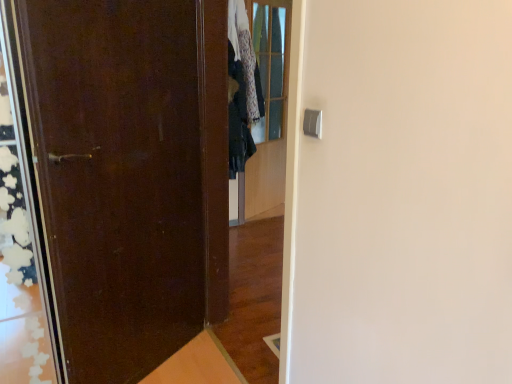
Locate an element on the screen. The width and height of the screenshot is (512, 384). dark green fabric at center is located at coordinates (242, 88).

What do you see at coordinates (242, 88) in the screenshot? I see `dark green fabric at center` at bounding box center [242, 88].

The image size is (512, 384). Identify the location of clear glass door at upper center. (268, 110).

The image size is (512, 384). What do you see at coordinates (268, 110) in the screenshot? I see `clear glass door at upper center` at bounding box center [268, 110].

You are a GUI agent. You are given a task and a screenshot of the screen. Output one action in this format:
    pyautogui.click(x=<x>, y=<y>)
    Task: Click on the matte dark brown door at left
    
    Given the screenshot: What is the action you would take?
    pyautogui.click(x=119, y=176)

Is clear glass door at upper center thinner than matte dark brown door at left?

Yes, clear glass door at upper center is thinner than matte dark brown door at left.

From a real-world perspective, between clear glass door at upper center and matte dark brown door at left, who is vertically higher?

clear glass door at upper center, from a real-world perspective.

Which is closer to the camera, (257, 211) or (242, 85)?

Point (257, 211).

Is clear glass door at upper center completely or partially outside of dark green fabric at center?

Absolutely, clear glass door at upper center is external to dark green fabric at center.

From the picture: Is clear glass door at upper center wider than dark green fabric at center?

Incorrect, the width of clear glass door at upper center does not surpass that of dark green fabric at center.

How much distance is there between dark green fabric at center and clear glass door at upper center?

dark green fabric at center and clear glass door at upper center are 13.16 inches apart from each other.

The height and width of the screenshot is (384, 512). I want to click on clothing above the clear glass door at upper center (from the image's perspective), so click(242, 88).

Is dark green fabric at center aimed at clear glass door at upper center?

No, dark green fabric at center is not aimed at clear glass door at upper center.

Looking at this image, is the surface of dark green fabric at center in direct contact with clear glass door at upper center?

No, dark green fabric at center is not touching clear glass door at upper center.

Is clear glass door at upper center located within matte dark brown door at left?

That's incorrect, clear glass door at upper center is not inside matte dark brown door at left.

Does matte dark brown door at left have a lesser height compared to clear glass door at upper center?

Yes, matte dark brown door at left is shorter than clear glass door at upper center.

Considering the relative positions of matte dark brown door at left and clear glass door at upper center in the image provided, is matte dark brown door at left to the right of clear glass door at upper center from the viewer's perspective?

In fact, matte dark brown door at left is to the left of clear glass door at upper center.

Considering the positions of point (157, 84) and point (286, 54), is point (157, 84) closer or farther from the camera than point (286, 54)?

Point (157, 84) appears to be closer to the viewer than point (286, 54).

Who is taller, matte dark brown door at left or dark green fabric at center?

matte dark brown door at left.

Considering the positions of objects matte dark brown door at left and dark green fabric at center in the image provided, who is in front, matte dark brown door at left or dark green fabric at center?

matte dark brown door at left is more forward.

From the picture: Is matte dark brown door at left oriented towards dark green fabric at center?

No, matte dark brown door at left is not facing towards dark green fabric at center.

From a real-world perspective, is dark green fabric at center above or below matte dark brown door at left?

Clearly, from a real-world perspective, dark green fabric at center is above matte dark brown door at left.

Do you think dark green fabric at center is within matte dark brown door at left, or outside of it?

The correct answer is: outside.

From the image's perspective, is dark green fabric at center over matte dark brown door at left?

Indeed, from the image's perspective, dark green fabric at center is shown above matte dark brown door at left.

You are a GUI agent. You are given a task and a screenshot of the screen. Output one action in this format:
    pyautogui.click(x=<x>, y=<y>)
    Task: Click on the door below the clear glass door at upper center (from the image's perspective)
    The image size is (512, 384).
    Given the screenshot: What is the action you would take?
    pyautogui.click(x=119, y=176)

At what (x,y) coordinates should I click in order to perform the action: click on glass door located on the right of dark green fabric at center. Please return your answer as a coordinate pair (x, y). The height and width of the screenshot is (384, 512). Looking at the image, I should click on (268, 110).

Looking at the image, which one is located closer to clear glass door at upper center, matte dark brown door at left or dark green fabric at center?

Among the two, dark green fabric at center is located nearer to clear glass door at upper center.

Estimate the real-world distances between objects in this image. Which object is closer to dark green fabric at center, matte dark brown door at left or clear glass door at upper center?

clear glass door at upper center.

Estimate the real-world distances between objects in this image. Which object is closer to matte dark brown door at left, clear glass door at upper center or dark green fabric at center?

dark green fabric at center is closer to matte dark brown door at left.

Which object lies nearer to the anchor point clear glass door at upper center, dark green fabric at center or matte dark brown door at left?

dark green fabric at center is closer to clear glass door at upper center.

Consider the image. Estimate the real-world distances between objects in this image. Which object is closer to matte dark brown door at left, dark green fabric at center or clear glass door at upper center?

dark green fabric at center is positioned closer to the anchor matte dark brown door at left.

Which object lies nearer to the anchor point dark green fabric at center, clear glass door at upper center or matte dark brown door at left?

clear glass door at upper center lies closer to dark green fabric at center than the other object.

Where is `clothing located between matte dark brown door at left and clear glass door at upper center in the depth direction`? clothing located between matte dark brown door at left and clear glass door at upper center in the depth direction is located at coordinates (242, 88).